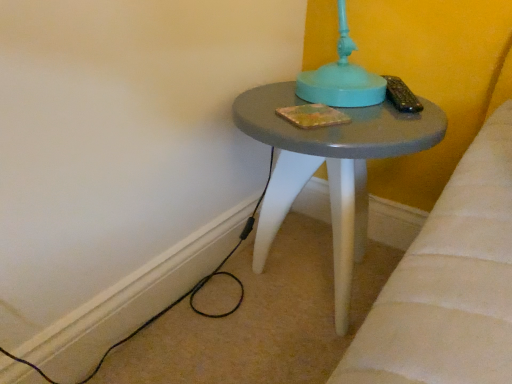
Question: Is black wire at lower left to the right of matte gray stool at center from the viewer's perspective?

Choices:
 (A) no
 (B) yes

Answer: (A)

Question: Is black wire at lower left placed right next to matte gray stool at center?

Choices:
 (A) no
 (B) yes

Answer: (A)

Question: From the image's perspective, would you say black wire at lower left is positioned over matte gray stool at center?

Choices:
 (A) yes
 (B) no

Answer: (B)

Question: Is black wire at lower left to the left of matte gray stool at center from the viewer's perspective?

Choices:
 (A) yes
 (B) no

Answer: (A)

Question: Can you confirm if black wire at lower left is smaller than matte gray stool at center?

Choices:
 (A) yes
 (B) no

Answer: (A)

Question: Does black wire at lower left have a larger size compared to matte gray stool at center?

Choices:
 (A) yes
 (B) no

Answer: (B)

Question: Can you confirm if matte gray stool at center is wider than black wire at lower left?

Choices:
 (A) no
 (B) yes

Answer: (B)

Question: From the image's perspective, is matte gray stool at center on black wire at lower left?

Choices:
 (A) yes
 (B) no

Answer: (A)

Question: Considering the relative sizes of matte gray stool at center and black wire at lower left in the image provided, is matte gray stool at center thinner than black wire at lower left?

Choices:
 (A) yes
 (B) no

Answer: (B)

Question: From a real-world perspective, is matte gray stool at center on black wire at lower left?

Choices:
 (A) yes
 (B) no

Answer: (A)

Question: Can you confirm if matte gray stool at center is positioned to the right of black wire at lower left?

Choices:
 (A) no
 (B) yes

Answer: (B)

Question: Considering the relative positions of matte gray stool at center and black wire at lower left in the image provided, is matte gray stool at center to the left of black wire at lower left from the viewer's perspective?

Choices:
 (A) yes
 (B) no

Answer: (B)

Question: From a real-world perspective, relative to matte gray stool at center, is black wire at lower left vertically above or below?

Choices:
 (A) above
 (B) below

Answer: (B)